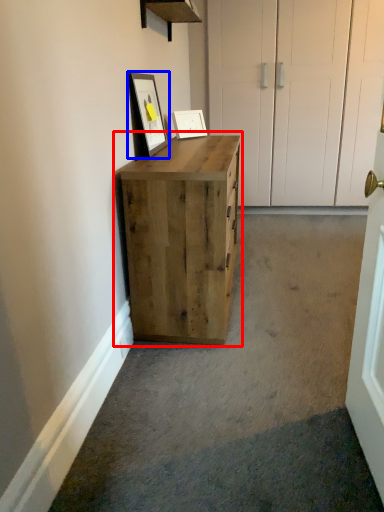
Question: Among these objects, which one is farthest to the camera, chest of drawers (highlighted by a red box) or picture frame (highlighted by a blue box)?

Choices:
 (A) chest of drawers
 (B) picture frame

Answer: (B)